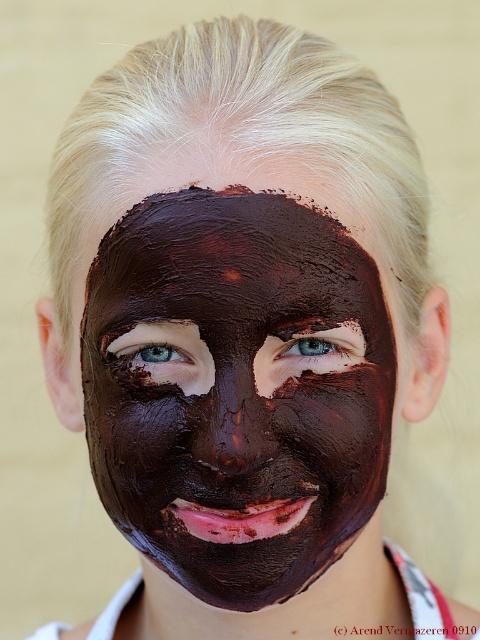
Is matte chocolate mask at center above brown matte eye at center?

No.

Is matte chocolate mask at center to the right of brown matte eye at center from the viewer's perspective?

No, matte chocolate mask at center is not to the right of brown matte eye at center.

The width and height of the screenshot is (480, 640). Find the location of `matte chocolate mask at center`. matte chocolate mask at center is located at coordinates (236, 392).

Is the position of brown matte eye at center more distant than that of blue matte eye at center?

No, it is in front of blue matte eye at center.

Can you confirm if brown matte eye at center is taller than blue matte eye at center?

Yes.

Identify the location of brown matte eye at center. The height and width of the screenshot is (640, 480). (x=323, y=342).

Where is `brown matte eye at center`? brown matte eye at center is located at coordinates (323, 342).

From the picture: Can you confirm if matte chocolate mask at center is taller than blue matte eye at center?

Correct, matte chocolate mask at center is much taller as blue matte eye at center.

The height and width of the screenshot is (640, 480). In order to click on matte chocolate mask at center in this screenshot , I will do `click(236, 392)`.

Find the location of `matte chocolate mask at center`. matte chocolate mask at center is located at coordinates (236, 392).